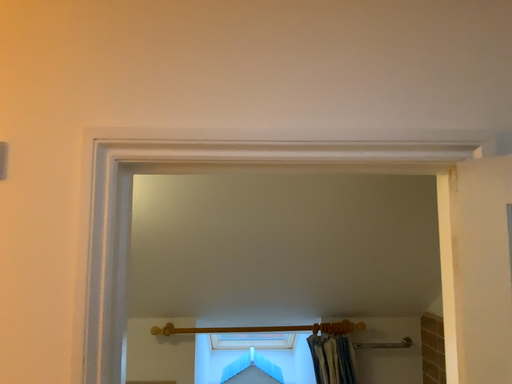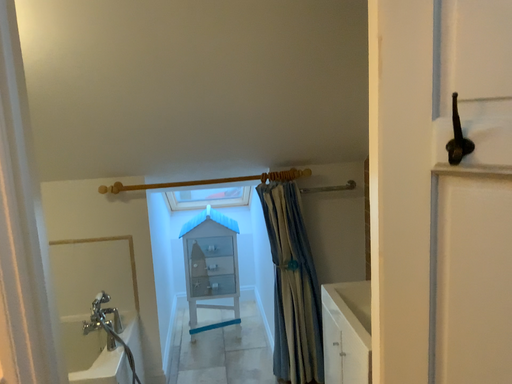
Question: Which way did the camera rotate in the video?

Choices:
 (A) rotated downward
 (B) rotated upward

Answer: (A)